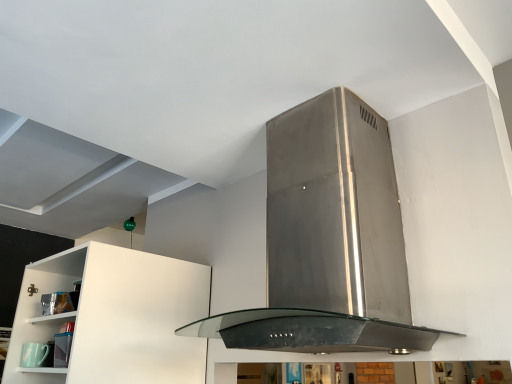
In the scene shown: Measure the distance between matte green cup at lower left and camera.

The distance of matte green cup at lower left from camera is 1.73 meters.

The height and width of the screenshot is (384, 512). What do you see at coordinates (34, 354) in the screenshot? I see `matte green cup at lower left` at bounding box center [34, 354].

Where is `matte green cup at lower left`? This screenshot has height=384, width=512. matte green cup at lower left is located at coordinates (34, 354).

This screenshot has width=512, height=384. What do you see at coordinates (329, 239) in the screenshot?
I see `stainless steel range hood at center` at bounding box center [329, 239].

At what (x,y) coordinates should I click in order to perform the action: click on stainless steel range hood at center. Please return your answer as a coordinate pair (x, y). The image size is (512, 384). Looking at the image, I should click on (329, 239).

I want to click on matte green cup at lower left, so click(x=34, y=354).

Is stainless steel range hood at center at the left side of matte green cup at lower left?

No, stainless steel range hood at center is not to the left of matte green cup at lower left.

From the picture: Does stainless steel range hood at center come behind matte green cup at lower left?

No, the depth of stainless steel range hood at center is less than that of matte green cup at lower left.

Is point (339, 228) closer or farther from the camera than point (29, 364)?

Point (339, 228).

From the image's perspective, would you say stainless steel range hood at center is shown under matte green cup at lower left?

Actually, stainless steel range hood at center appears above matte green cup at lower left in the image.

From a real-world perspective, is stainless steel range hood at center positioned over matte green cup at lower left based on gravity?

Yes, from a real-world perspective, stainless steel range hood at center is on top of matte green cup at lower left.

In terms of width, does stainless steel range hood at center look wider or thinner when compared to matte green cup at lower left?

In the image, stainless steel range hood at center appears to be wider than matte green cup at lower left.

Consider the image. Between stainless steel range hood at center and matte green cup at lower left, which one has more height?

With more height is stainless steel range hood at center.

Looking at the image, does stainless steel range hood at center seem bigger or smaller compared to matte green cup at lower left?

Clearly, stainless steel range hood at center is larger in size than matte green cup at lower left.

Would you say stainless steel range hood at center is inside or outside matte green cup at lower left?

stainless steel range hood at center is located beyond the bounds of matte green cup at lower left.

Are stainless steel range hood at center and matte green cup at lower left making contact?

No.

Consider the image. Could you tell me if stainless steel range hood at center is turned towards matte green cup at lower left?

No, stainless steel range hood at center is not facing towards matte green cup at lower left.

This screenshot has width=512, height=384. Find the location of `home appliance on the right of matte green cup at lower left`. home appliance on the right of matte green cup at lower left is located at coordinates (329, 239).

Can you confirm if matte green cup at lower left is positioned to the right of stainless steel range hood at center?

No.

Considering the positions of objects matte green cup at lower left and stainless steel range hood at center in the image provided, who is behind, matte green cup at lower left or stainless steel range hood at center?

matte green cup at lower left is further from the camera.

Is point (24, 351) positioned in front of point (389, 165)?

No, it is not.

In the scene shown: From the image's perspective, which one is positioned higher, matte green cup at lower left or stainless steel range hood at center?

stainless steel range hood at center appears higher in the image.

From a real-world perspective, who is located lower, matte green cup at lower left or stainless steel range hood at center?

matte green cup at lower left, from a real-world perspective.

Which of these two, matte green cup at lower left or stainless steel range hood at center, is thinner?

matte green cup at lower left is thinner.

Considering the sizes of objects matte green cup at lower left and stainless steel range hood at center in the image provided, who is shorter, matte green cup at lower left or stainless steel range hood at center?

matte green cup at lower left.

Between matte green cup at lower left and stainless steel range hood at center, which one has larger size?

stainless steel range hood at center.

Would you say matte green cup at lower left is inside or outside stainless steel range hood at center?

matte green cup at lower left is outside stainless steel range hood at center.

Is matte green cup at lower left directly adjacent to stainless steel range hood at center?

No, matte green cup at lower left is not beside stainless steel range hood at center.

Is matte green cup at lower left looking in the opposite direction of stainless steel range hood at center?

That's not correct — matte green cup at lower left is not looking away from stainless steel range hood at center.

Based on the photo, how many degrees apart are the facing directions of matte green cup at lower left and stainless steel range hood at center?

The angular difference between matte green cup at lower left and stainless steel range hood at center is 1.4 degrees.

How far apart are matte green cup at lower left and stainless steel range hood at center?

matte green cup at lower left is 4.35 feet from stainless steel range hood at center.

Where is `appliance to the left of stainless steel range hood at center`? Image resolution: width=512 pixels, height=384 pixels. appliance to the left of stainless steel range hood at center is located at coordinates (34, 354).

Find the location of a particular element. Image resolution: width=512 pixels, height=384 pixels. appliance located on the left of stainless steel range hood at center is located at coordinates (34, 354).

At what (x,y) coordinates should I click in order to perform the action: click on appliance lying below the stainless steel range hood at center (from the image's perspective). Please return your answer as a coordinate pair (x, y). This screenshot has width=512, height=384. Looking at the image, I should click on (34, 354).